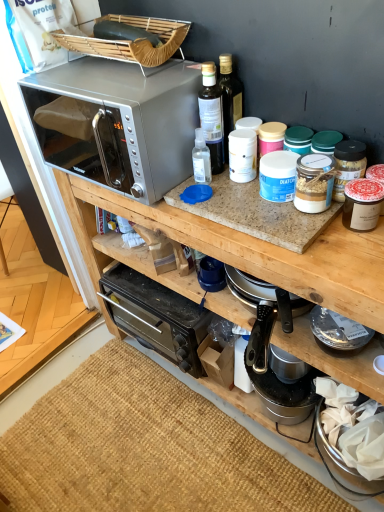
Question: Can you confirm if silver metallic microwave at upper left is bigger than burlap mat at lower center?

Choices:
 (A) yes
 (B) no

Answer: (A)

Question: Is burlap mat at lower center located within silver metallic microwave at upper left?

Choices:
 (A) yes
 (B) no

Answer: (B)

Question: From a real-world perspective, is silver metallic microwave at upper left positioned over burlap mat at lower center based on gravity?

Choices:
 (A) yes
 (B) no

Answer: (A)

Question: Is silver metallic microwave at upper left further to camera compared to burlap mat at lower center?

Choices:
 (A) no
 (B) yes

Answer: (A)

Question: Is silver metallic microwave at upper left not within burlap mat at lower center?

Choices:
 (A) no
 (B) yes

Answer: (B)

Question: Are silver metallic microwave at upper left and burlap mat at lower center beside each other?

Choices:
 (A) yes
 (B) no

Answer: (B)

Question: From a real-world perspective, is satin silver microwave at upper left positioned under matte glass jar at right, the first appliance positioned from the front, based on gravity?

Choices:
 (A) yes
 (B) no

Answer: (B)

Question: Is satin silver microwave at upper left oriented away from matte glass jar at right, the first appliance positioned from the front?

Choices:
 (A) yes
 (B) no

Answer: (B)

Question: From the image's perspective, is satin silver microwave at upper left under matte glass jar at right, the first appliance positioned from the front?

Choices:
 (A) no
 (B) yes

Answer: (A)

Question: Is the depth of satin silver microwave at upper left greater than that of matte glass jar at right, which is the first appliance from top to bottom?

Choices:
 (A) yes
 (B) no

Answer: (A)

Question: Considering the relative sizes of satin silver microwave at upper left and matte glass jar at right, which is the first appliance from top to bottom, in the image provided, is satin silver microwave at upper left wider than matte glass jar at right, which is the first appliance from top to bottom,?

Choices:
 (A) no
 (B) yes

Answer: (B)

Question: Considering the relative sizes of satin silver microwave at upper left and matte glass jar at right, the first appliance positioned from the front, in the image provided, is satin silver microwave at upper left shorter than matte glass jar at right, the first appliance positioned from the front,?

Choices:
 (A) yes
 (B) no

Answer: (B)

Question: From the image's perspective, does satin silver microwave at upper left appear higher than burlap mat at lower center?

Choices:
 (A) yes
 (B) no

Answer: (A)